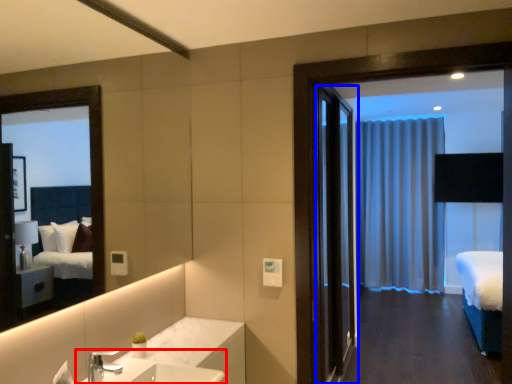
Question: Which point is further to the camera, sink (highlighted by a red box) or door (highlighted by a blue box)?

Choices:
 (A) sink
 (B) door

Answer: (B)